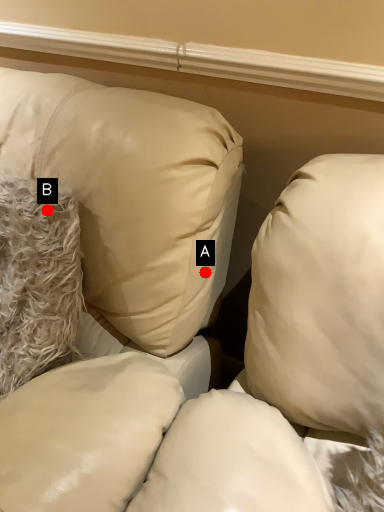
Question: Two points are circled on the image, labeled by A and B beside each circle. Which point is closer to the camera?

Choices:
 (A) A is closer
 (B) B is closer

Answer: (B)